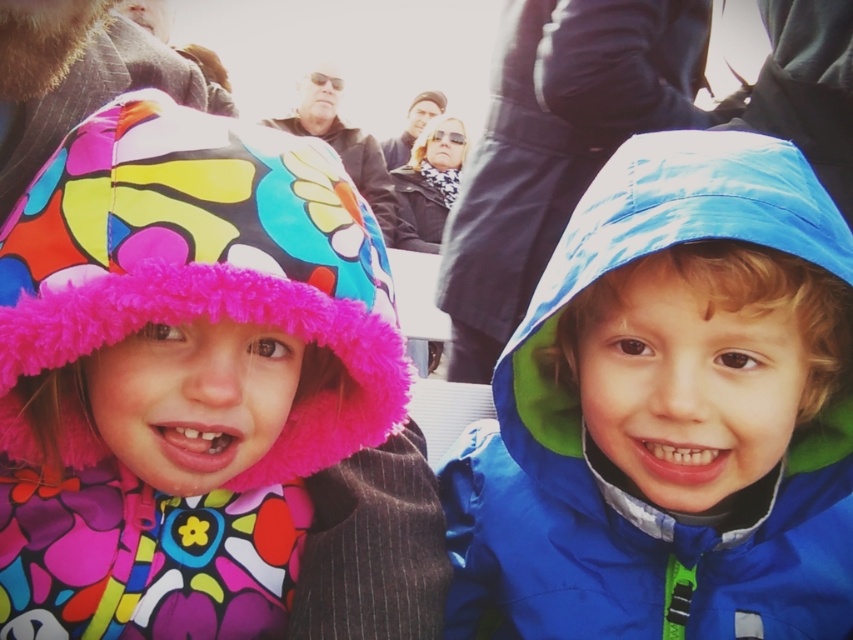
Does blue waterproof jacket at center appear on the left side of multicolored fleece hat at left?

In fact, blue waterproof jacket at center is to the right of multicolored fleece hat at left.

Is blue waterproof jacket at center positioned in front of multicolored fleece hat at left?

No, blue waterproof jacket at center is further to the viewer.

Is point (560, 477) more distant than point (201, 300)?

Yes, it is behind point (201, 300).

What are the coordinates of `blue waterproof jacket at center` in the screenshot? It's located at (618, 490).

Consider the image. Does blue waterproof jacket at center have a lesser height compared to blue shiny raincoat at center?

Indeed, blue waterproof jacket at center has a lesser height compared to blue shiny raincoat at center.

Between point (592, 580) and point (467, 266), which one is positioned in front?

Point (592, 580)

Who is more distant from viewer, (825, 634) or (581, 83)?

A: The point (581, 83) is more distant.

In order to click on blue waterproof jacket at center in this screenshot , I will do `click(618, 490)`.

Who is higher up, blue shiny raincoat at center or matte black hat at upper center?

matte black hat at upper center

Which is below, blue shiny raincoat at center or matte black hat at upper center?

blue shiny raincoat at center is lower down.

What do you see at coordinates (556, 145) in the screenshot? This screenshot has width=853, height=640. I see `blue shiny raincoat at center` at bounding box center [556, 145].

Find the location of `blue shiny raincoat at center`. blue shiny raincoat at center is located at coordinates [x=556, y=145].